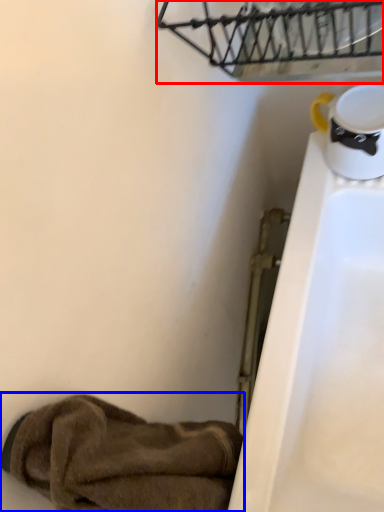
Question: Which point is further to the camera, basket (highlighted by a red box) or footwear (highlighted by a blue box)?

Choices:
 (A) basket
 (B) footwear

Answer: (A)